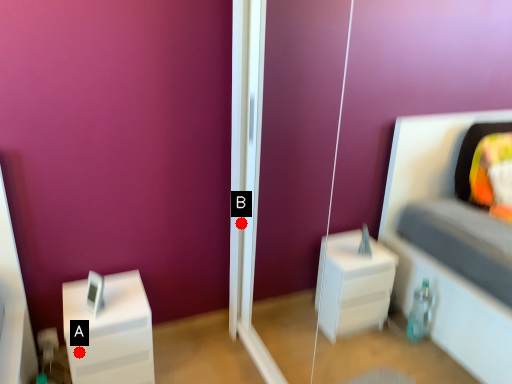
Question: Two points are circled on the image, labeled by A and B beside each circle. Which point appears closest to the camera in this image?

Choices:
 (A) A is closer
 (B) B is closer

Answer: (A)